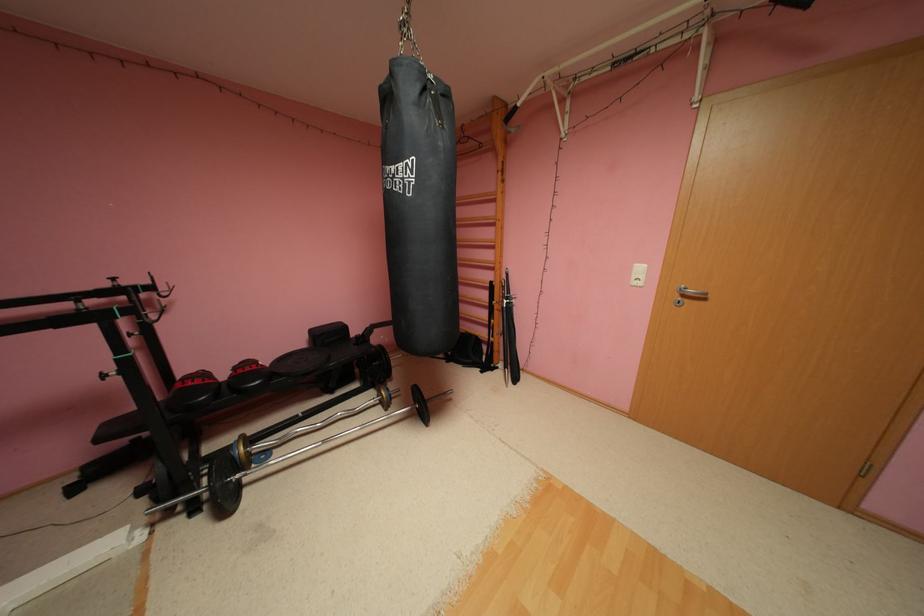
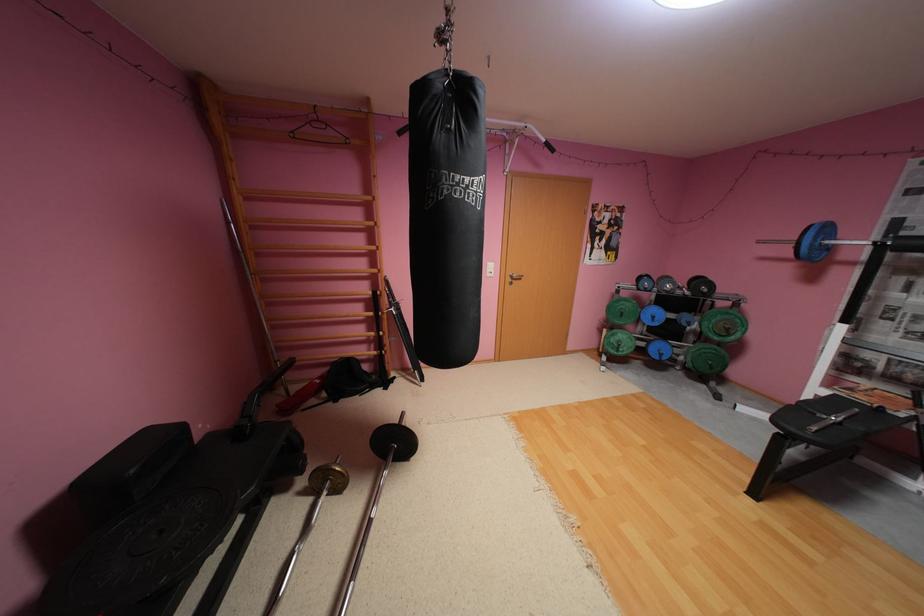
Find the pixel in the second image that matches pixel 402 168 in the first image.

(477, 179)